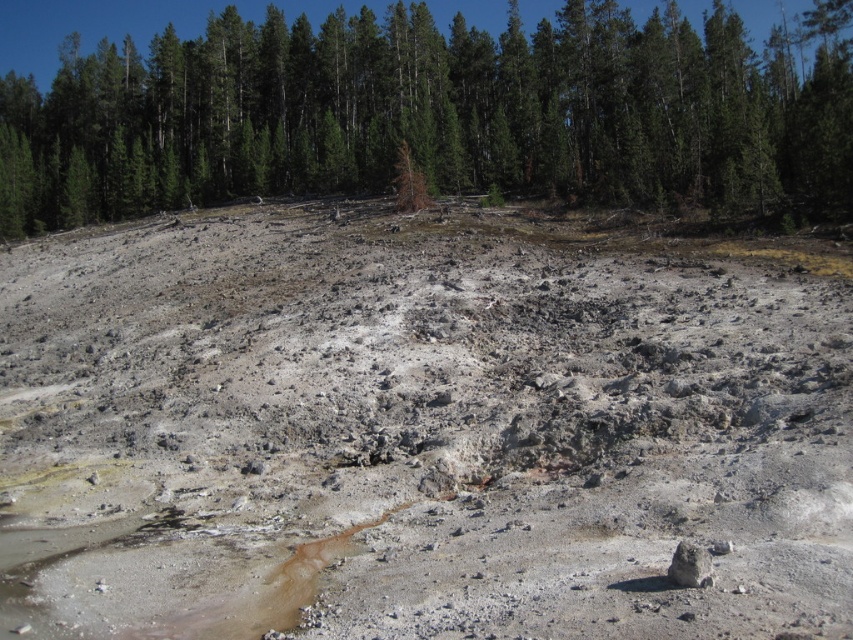
Question: Which object appears farthest from the camera in this image?

Choices:
 (A) green matte tree at upper center
 (B) gray rocky hillside at center

Answer: (A)

Question: Does gray rocky hillside at center have a smaller size compared to green matte tree at upper center?

Choices:
 (A) no
 (B) yes

Answer: (B)

Question: Is gray rocky hillside at center positioned at the back of green matte tree at upper center?

Choices:
 (A) yes
 (B) no

Answer: (B)

Question: Among these points, which one is nearest to the camera?

Choices:
 (A) (643, 109)
 (B) (335, 371)

Answer: (B)

Question: Which point is farther to the camera?

Choices:
 (A) gray rocky hillside at center
 (B) green matte tree at upper center

Answer: (B)

Question: Is gray rocky hillside at center smaller than green matte tree at upper center?

Choices:
 (A) yes
 (B) no

Answer: (A)